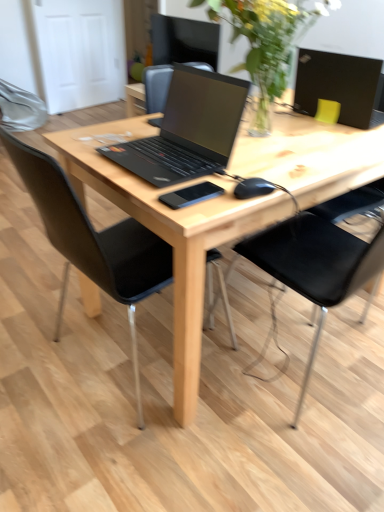
You are a GUI agent. You are given a task and a screenshot of the screen. Output one action in this format:
    pyautogui.click(x=<x>, y=<y>)
    Task: Click on the vacant region to the left of black matte phone at center
    The height and width of the screenshot is (512, 384).
    Given the screenshot: What is the action you would take?
    pyautogui.click(x=140, y=183)